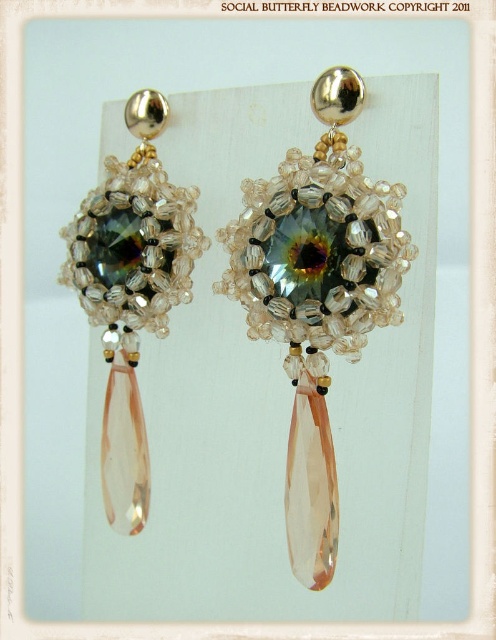
Question: Can you confirm if matte glass earring at center is positioned below matte silver beadwork at left?

Choices:
 (A) yes
 (B) no

Answer: (A)

Question: Observing the image, what is the correct spatial positioning of matte glass earring at center in reference to matte silver beadwork at left?

Choices:
 (A) right
 (B) left

Answer: (A)

Question: Which object is farther from the camera taking this photo?

Choices:
 (A) matte silver beadwork at left
 (B) matte glass earring at center

Answer: (A)

Question: Can you confirm if matte glass earring at center is wider than matte silver beadwork at left?

Choices:
 (A) yes
 (B) no

Answer: (A)

Question: Which point appears farthest from the camera in this image?

Choices:
 (A) (109, 380)
 (B) (326, 305)

Answer: (A)

Question: Among these points, which one is nearest to the camera?

Choices:
 (A) (354, 195)
 (B) (116, 179)

Answer: (A)